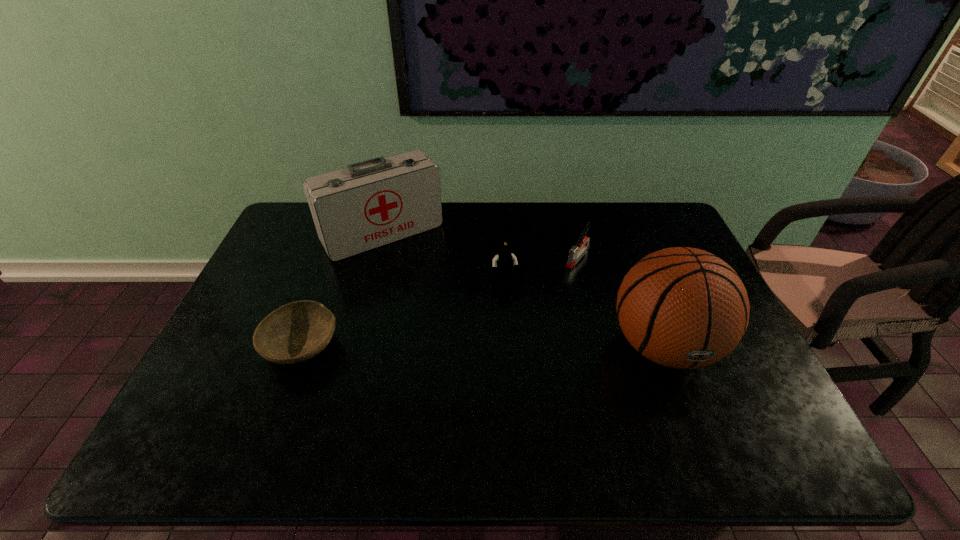
Identify the location of blank space that satisfies the following two spatial constraints: 1. on the back side of the third nearest object; 2. on the right side of the stapler. This screenshot has width=960, height=540. (504, 256).